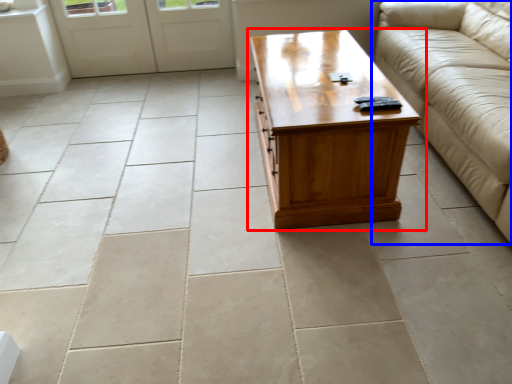
Question: Which object is closer to the camera taking this photo, coffee table (highlighted by a red box) or studio couch (highlighted by a blue box)?

Choices:
 (A) coffee table
 (B) studio couch

Answer: (B)